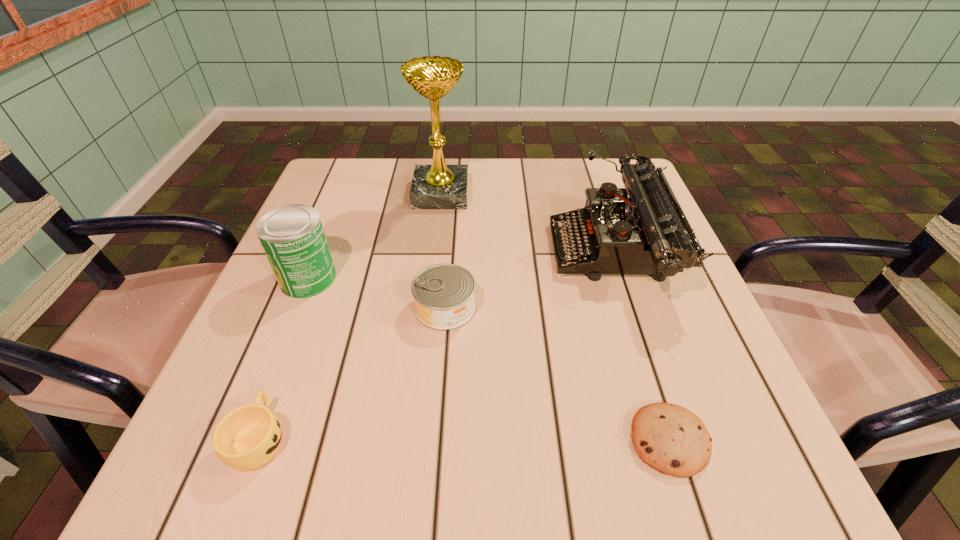
Where is `the tallest object`? Image resolution: width=960 pixels, height=540 pixels. the tallest object is located at coordinates (438, 186).

What are the coordinates of `typewriter` in the screenshot? It's located at (645, 234).

Where is `the taller can`? The image size is (960, 540). the taller can is located at coordinates coord(292,236).

Identify the location of the third shortest object. (444, 294).

Identify the location of the right can. Image resolution: width=960 pixels, height=540 pixels. (444, 294).

Image resolution: width=960 pixels, height=540 pixels. What are the coordinates of `the second shortest object` in the screenshot? It's located at (246, 438).

Find the location of a particular element. The width and height of the screenshot is (960, 540). cookie is located at coordinates (671, 439).

Where is `free space located 0.270m on the front-facing side of the award`? The width and height of the screenshot is (960, 540). free space located 0.270m on the front-facing side of the award is located at coordinates (576, 194).

The image size is (960, 540). I want to click on blank space located on the keyboard of the typewriter, so click(x=453, y=253).

You are a GUI agent. You are given a task and a screenshot of the screen. Output one action in this format:
    pyautogui.click(x=<x>, y=<y>)
    Task: Click on the vacant point located 0.130m on the keyboard of the typewriter
    The width and height of the screenshot is (960, 540).
    Given the screenshot: What is the action you would take?
    pyautogui.click(x=491, y=253)